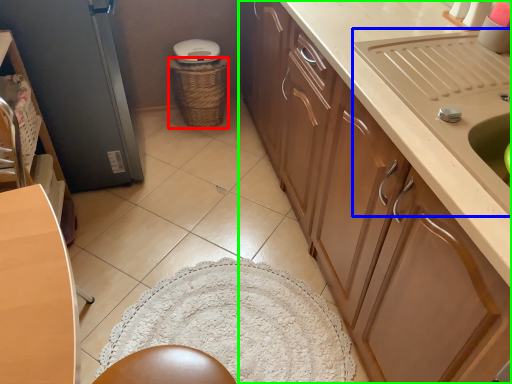
Question: Considering the real-world distances, which object is closest to basket (highlighted by a red box)? sink (highlighted by a blue box) or cabinetry (highlighted by a green box).

Choices:
 (A) sink
 (B) cabinetry

Answer: (B)